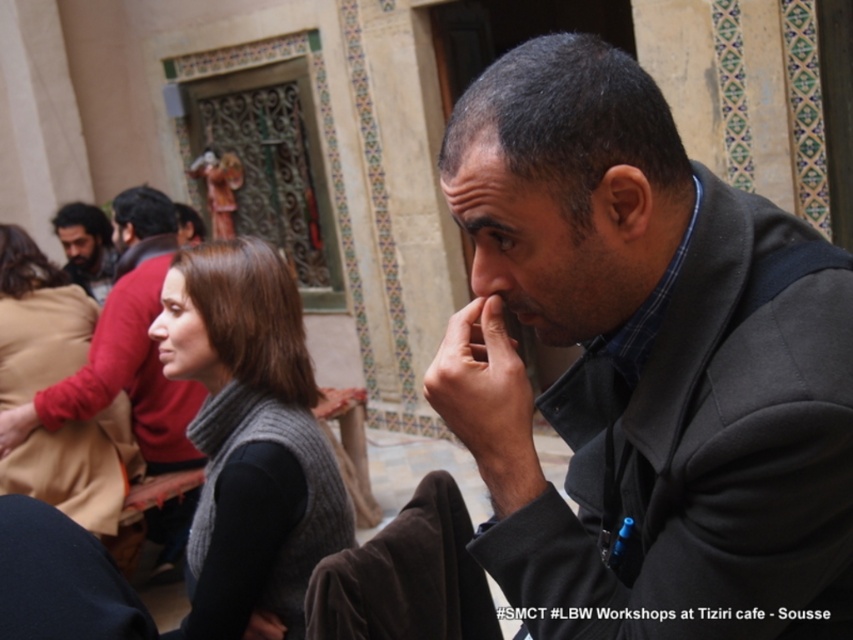
You are an artist sketching the man in the courtyard scene. You need to ensure proportions are accurate. Which object has a greater width between the dark brown hair at left and the matte black nose at center?

The dark brown hair at left has a greater width compared to the matte black nose at center.

You are a photographer trying to capture a closeup shot of the dark skin hand at center and the matte black nose at center in the scene. Given that your camera can only focus on objects within a 5 meter range, will you be able to capture both subjects in focus at the same time?

The dark skin hand at center and the matte black nose at center are 6.05 meters apart from each other, which exceeds the camera focus range of 5 meters. Therefore, you cannot capture both subjects in focus simultaneously.